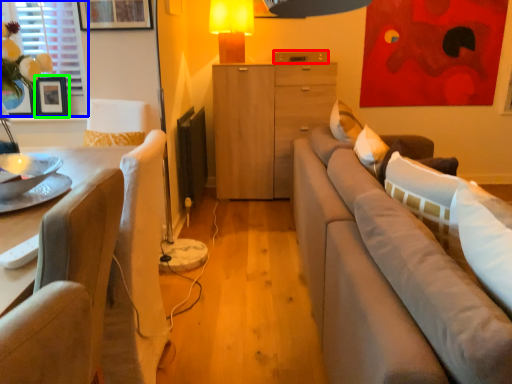
Question: Based on their relative distances, which object is nearer to drawer (highlighted by a red box)? Choose from window screen (highlighted by a blue box) and picture frame (highlighted by a green box).

Choices:
 (A) window screen
 (B) picture frame

Answer: (A)